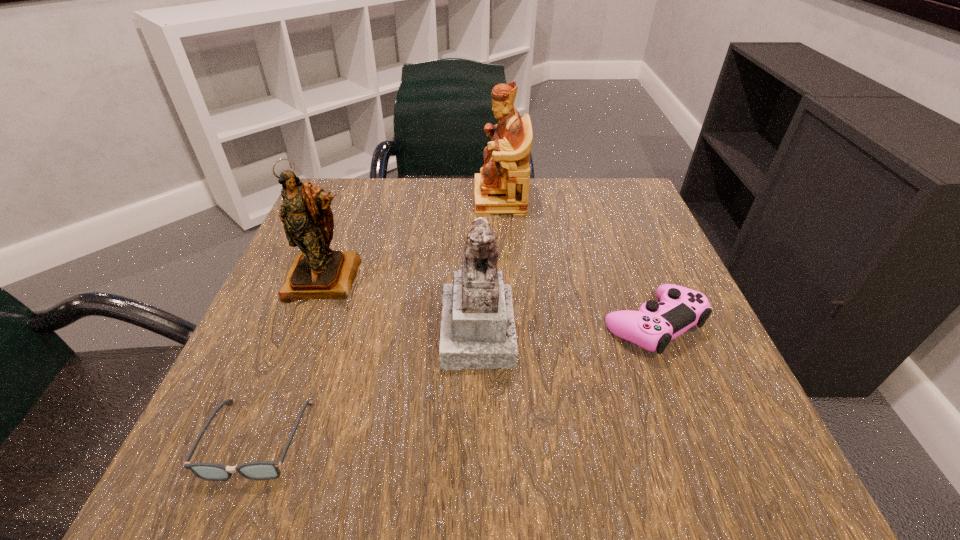
Locate an element on the screen. The width and height of the screenshot is (960, 540). vacant space at the near left corner of the desktop is located at coordinates (302, 465).

The width and height of the screenshot is (960, 540). What are the coordinates of `free space at the far right corner of the desktop` in the screenshot? It's located at (589, 230).

Where is `vacant space at the near right corner of the desktop`? vacant space at the near right corner of the desktop is located at coordinates (691, 429).

Locate an element on the screen. This screenshot has height=540, width=960. vacant area between the rightmost object and the nearest object is located at coordinates 455,382.

At what (x,y) coordinates should I click in order to perform the action: click on vacant area that lies between the leftmost figurine and the shortest object. Please return your answer as a coordinate pair (x, y). The image size is (960, 540). Looking at the image, I should click on (291, 359).

Where is `free spot between the farthest object and the spectacles`? This screenshot has height=540, width=960. free spot between the farthest object and the spectacles is located at coordinates pyautogui.click(x=378, y=319).

Where is `empty space between the leftmost figurine and the nearest object`? The width and height of the screenshot is (960, 540). empty space between the leftmost figurine and the nearest object is located at coordinates (291, 359).

Choose which object is the fourth nearest neighbor to the nearest object. Please provide its 2D coordinates. Your answer should be formatted as a tuple, i.e. [(x, y)], where the tuple contains the x and y coordinates of a point satisfying the conditions above.

[(502, 187)]

Find the location of `object that can be found as the closest to the leftmost figurine`. object that can be found as the closest to the leftmost figurine is located at coordinates (477, 331).

Find the location of a particular element. This screenshot has height=540, width=960. the second closest figurine to the rightmost object is located at coordinates (502, 187).